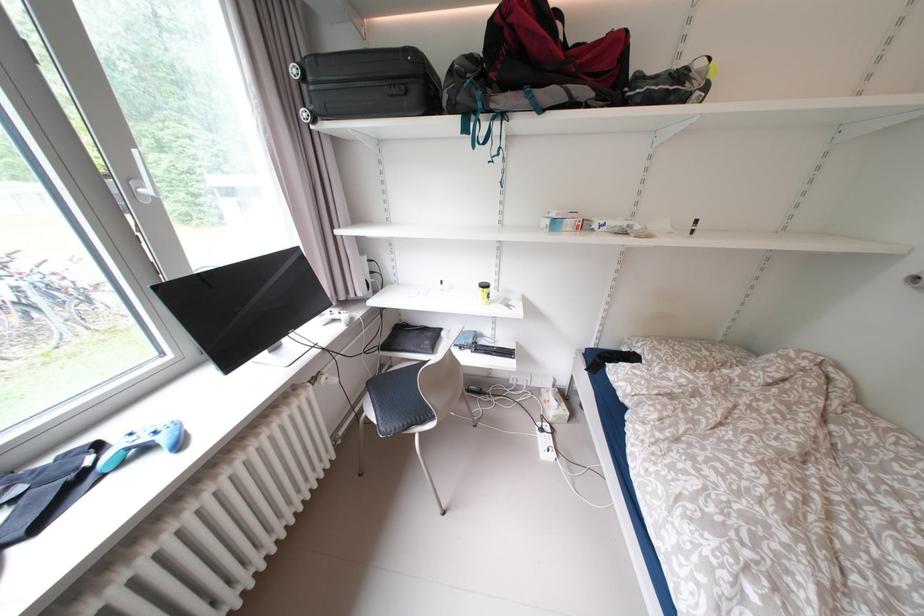
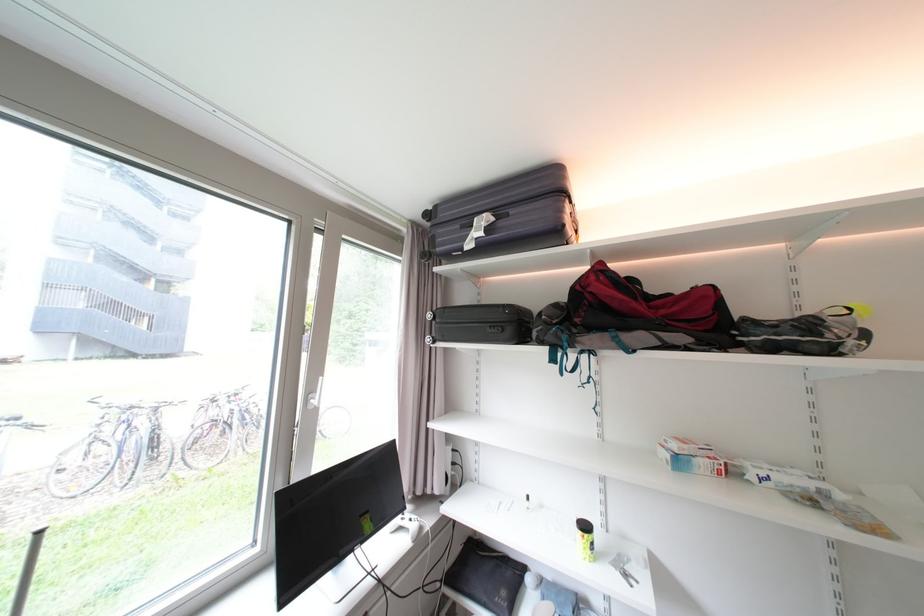
In the second image, find the point that corresponds to [691,84] in the first image.

(830, 337)